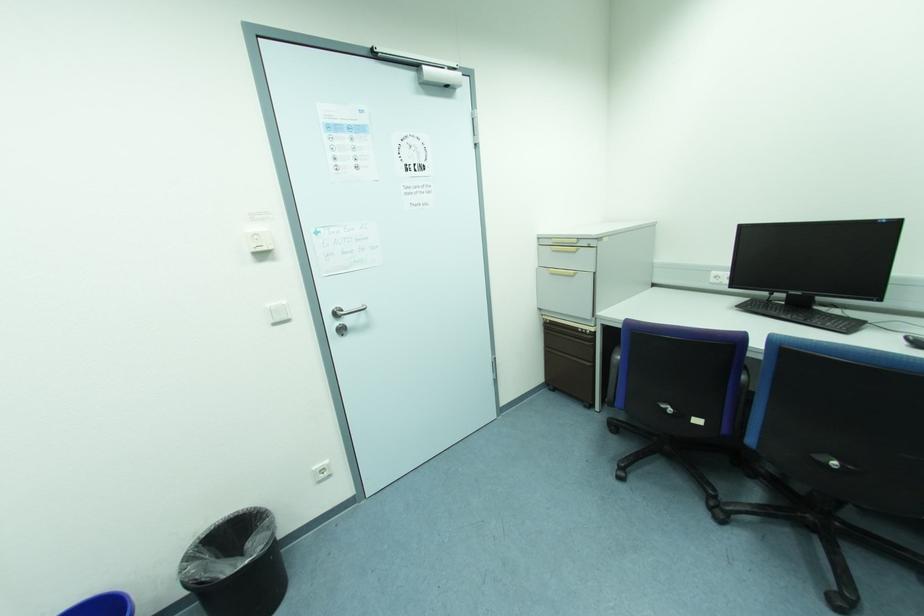
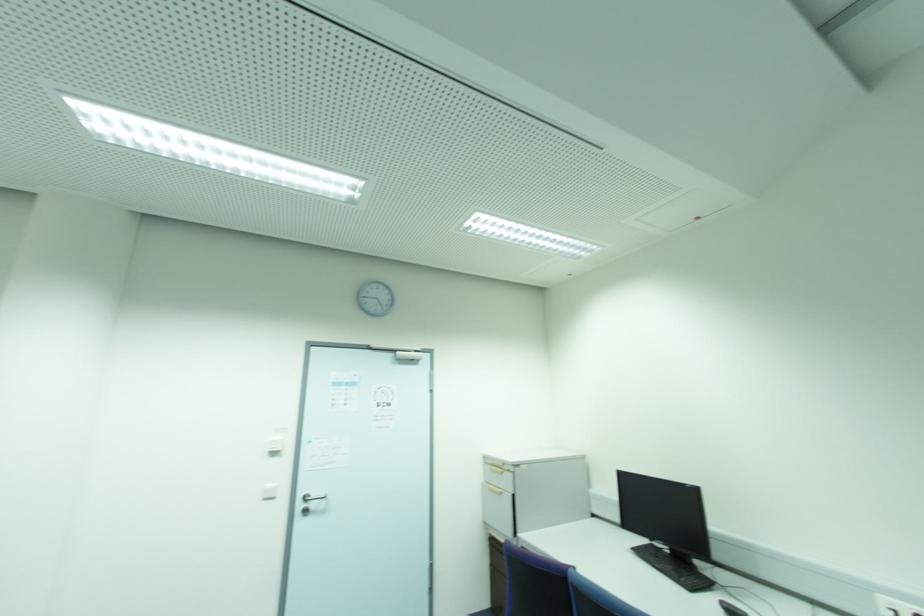
Where in the second image is the point corresponding to point 263,256 from the first image?

(274, 454)